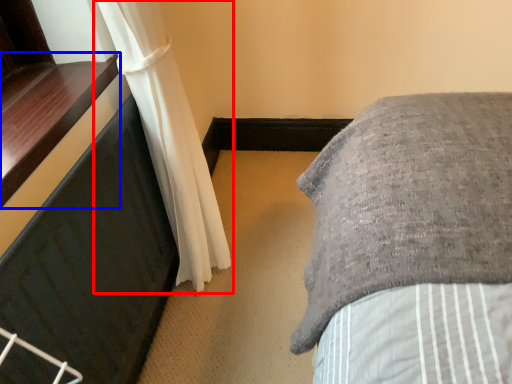
Question: Which object appears closest to the camera in this image, curtain (highlighted by a red box) or window sill (highlighted by a blue box)?

Choices:
 (A) curtain
 (B) window sill

Answer: (B)